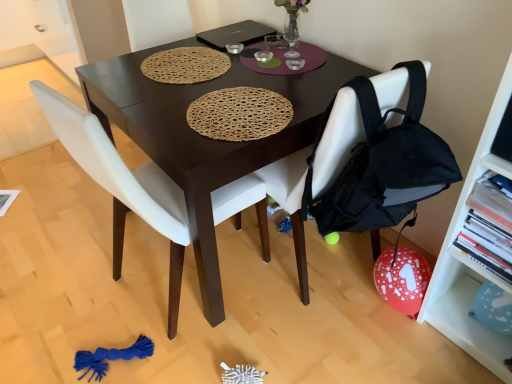
Question: Is white plastic shelf at right not inside black fabric chair at center, positioned as the second chair in left-to-right order?

Choices:
 (A) no
 (B) yes

Answer: (B)

Question: From the image's perspective, is white plastic shelf at right below black fabric chair at center, positioned as the second chair in left-to-right order?

Choices:
 (A) no
 (B) yes

Answer: (B)

Question: Can you confirm if white plastic shelf at right is wider than black fabric chair at center, positioned as the second chair in left-to-right order?

Choices:
 (A) no
 (B) yes

Answer: (A)

Question: From the image's perspective, is white plastic shelf at right on top of black fabric chair at center, the first chair when ordered from right to left?

Choices:
 (A) no
 (B) yes

Answer: (A)

Question: Can you confirm if white plastic shelf at right is shorter than black fabric chair at center, positioned as the second chair in left-to-right order?

Choices:
 (A) yes
 (B) no

Answer: (B)

Question: From a real-world perspective, is white plastic shelf at right positioned over black fabric chair at center, positioned as the second chair in left-to-right order, based on gravity?

Choices:
 (A) no
 (B) yes

Answer: (B)

Question: Does white matte chair at center, the first chair positioned from the left, appear on the right side of black matte laptop at upper center?

Choices:
 (A) yes
 (B) no

Answer: (B)

Question: Is white matte chair at center, the first chair positioned from the left, thinner than black matte laptop at upper center?

Choices:
 (A) yes
 (B) no

Answer: (B)

Question: From the image's perspective, is white matte chair at center, the first chair positioned from the left, located above black matte laptop at upper center?

Choices:
 (A) no
 (B) yes

Answer: (A)

Question: From the image's perspective, is white matte chair at center, the first chair positioned from the left, located beneath black matte laptop at upper center?

Choices:
 (A) no
 (B) yes

Answer: (B)

Question: Is white matte chair at center, the first chair positioned from the left, facing away from black matte laptop at upper center?

Choices:
 (A) no
 (B) yes

Answer: (A)

Question: Considering the relative positions of white matte chair at center, the first chair positioned from the left, and black matte laptop at upper center in the image provided, is white matte chair at center, the first chair positioned from the left, to the left of black matte laptop at upper center from the viewer's perspective?

Choices:
 (A) no
 (B) yes

Answer: (B)

Question: Is black fabric chair at center, positioned as the second chair in left-to-right order, not within black matte laptop at upper center?

Choices:
 (A) no
 (B) yes

Answer: (B)